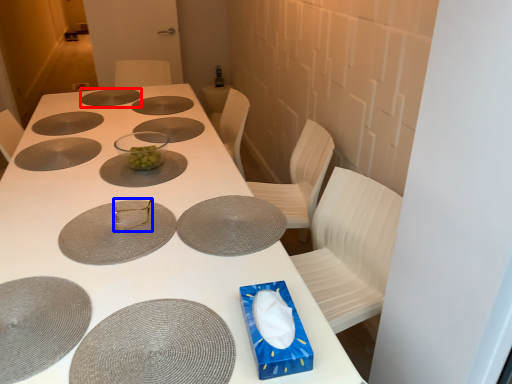
Question: Among these objects, which one is nearest to the camera, glass plate (highlighted by a red box) or tableware (highlighted by a blue box)?

Choices:
 (A) glass plate
 (B) tableware

Answer: (B)